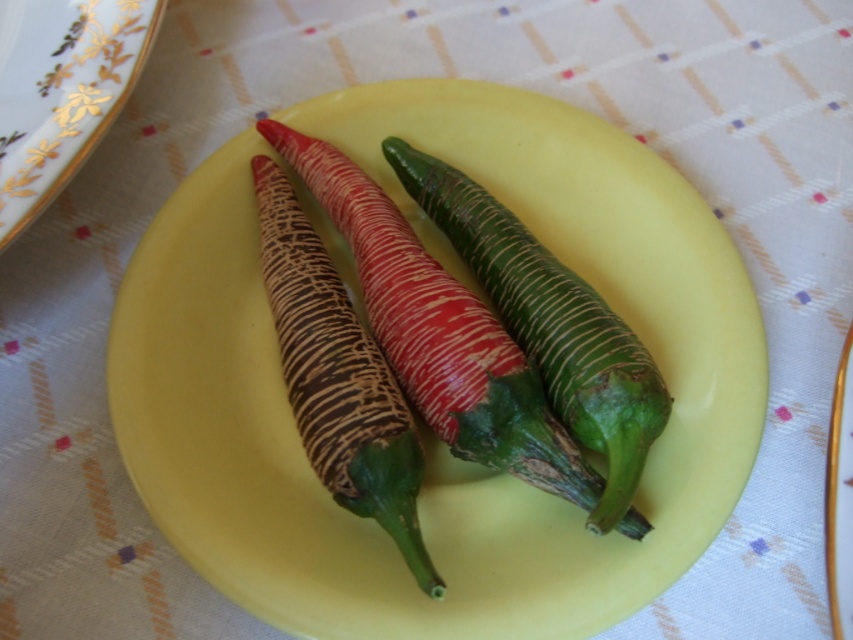
Question: Is yellow glossy plate at center to the left of green textured chili pepper at center from the viewer's perspective?

Choices:
 (A) no
 (B) yes

Answer: (B)

Question: Which point appears closest to the camera in this image?

Choices:
 (A) (509, 220)
 (B) (264, 228)
 (C) (7, 93)

Answer: (C)

Question: Which point appears farthest from the camera in this image?

Choices:
 (A) (235, 529)
 (B) (666, 403)

Answer: (B)

Question: Considering the relative positions of green textured chili pepper at center and textured brown chili pepper at center in the image provided, where is green textured chili pepper at center located with respect to textured brown chili pepper at center?

Choices:
 (A) right
 (B) left

Answer: (A)

Question: Estimate the real-world distances between objects in this image. Which object is farther from the yellow glossy plate at center?

Choices:
 (A) textured brown chili pepper at center
 (B) white porcelain plate at upper left
 (C) green textured chili pepper at center

Answer: (B)

Question: Can you confirm if yellow glossy plate at center is thinner than textured brown chili pepper at center?

Choices:
 (A) no
 (B) yes

Answer: (A)